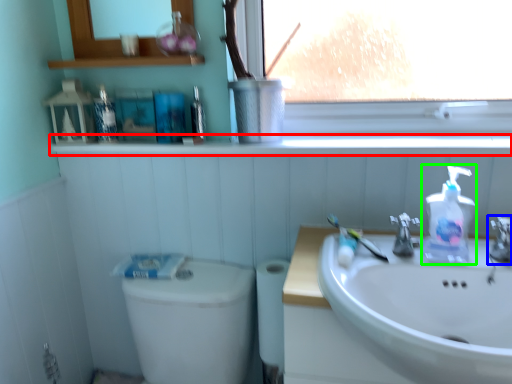
Question: Estimate the real-world distances between objects in this image. Which object is farther from window sill (highlighted by a red box), tap (highlighted by a blue box) or soap dispenser (highlighted by a green box)?

Choices:
 (A) tap
 (B) soap dispenser

Answer: (A)